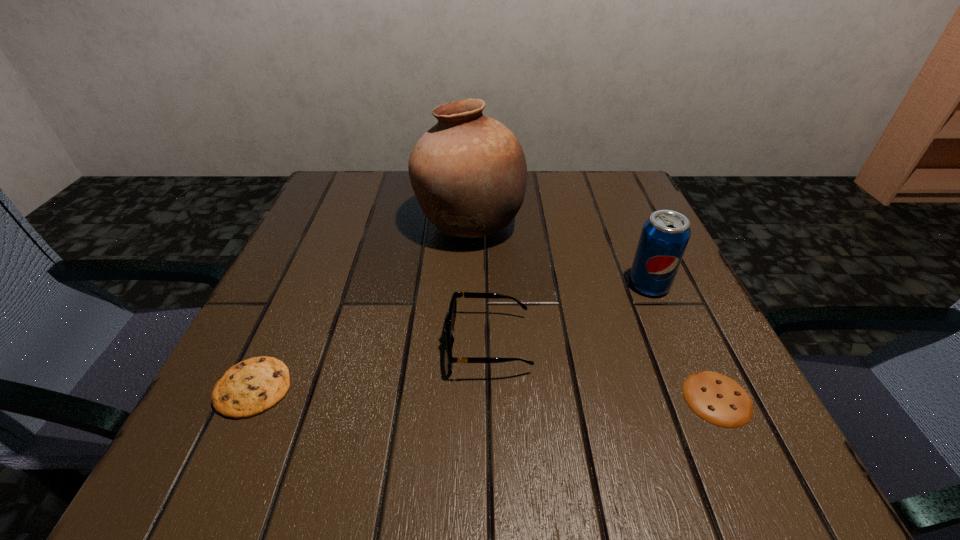
You are a GUI agent. You are given a task and a screenshot of the screen. Output one action in this format:
    pyautogui.click(x=<x>, y=<y>)
    Task: Click on the free space located 0.080m on the front of the pop soda
    The width and height of the screenshot is (960, 540).
    Given the screenshot: What is the action you would take?
    pyautogui.click(x=670, y=333)

Where is `vacant space located on the front-facing side of the sunglasses`? vacant space located on the front-facing side of the sunglasses is located at coordinates (297, 344).

Where is `free space located 0.090m on the front-facing side of the sunglasses`? The height and width of the screenshot is (540, 960). free space located 0.090m on the front-facing side of the sunglasses is located at coordinates (390, 344).

You are a GUI agent. You are given a task and a screenshot of the screen. Output one action in this format:
    pyautogui.click(x=<x>, y=<y>)
    Task: Click on the free space located 0.060m on the front-facing side of the sunglasses
    The width and height of the screenshot is (960, 540).
    Given the screenshot: What is the action you would take?
    pyautogui.click(x=408, y=344)

Find the location of a particular element. The image size is (960, 540). free space located 0.380m on the right of the leftmost object is located at coordinates (550, 388).

Identify the location of free space located 0.100m on the left of the right cookie. (614, 398).

Identify the location of object that is at the far edge. (468, 172).

This screenshot has height=540, width=960. Identify the location of object situated at the near edge. 718,399.

In order to click on object located at the left edge in this screenshot , I will do `click(249, 388)`.

Where is `pop soda that is at the right edge`? This screenshot has height=540, width=960. pop soda that is at the right edge is located at coordinates [665, 235].